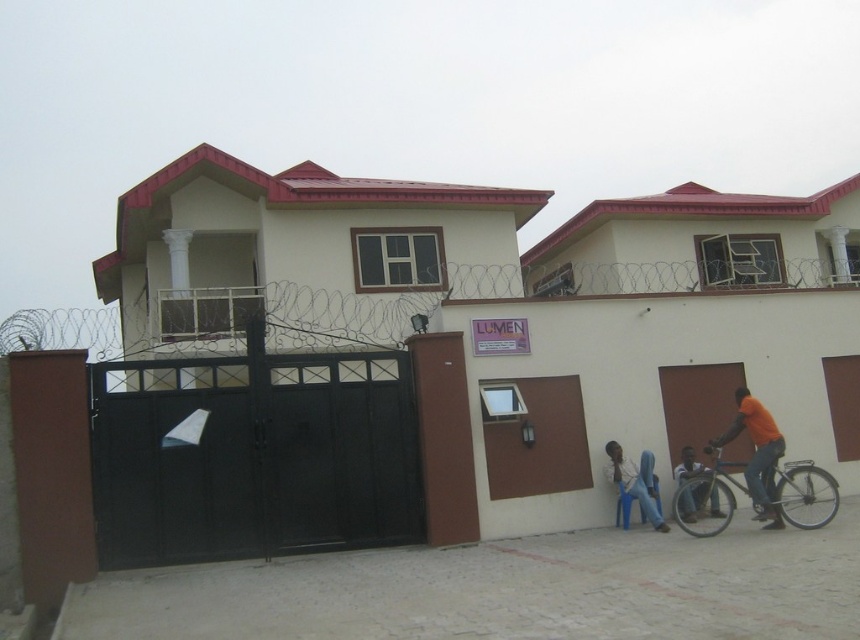
You are a delivery person trying to distinguish between two people wearing orange shirts in the scene. The scene has an orange cotton shirt at right and an orange shirt at lower right. Based on their clothing, which one is narrower?

The orange cotton shirt at right is narrower than the orange shirt at lower right because its width is less than the latter.

You are a delivery person trying to park your blue metallic bicycle at lower right next to the light blue plastic chair at lower right. Since the paved area is narrow, will the bicycle fit next to the chair without overlapping?

The blue metallic bicycle at lower right is wider than the light blue plastic chair at lower right, so there might not be enough space to park them side by side without overlapping. Check the available space carefully.

You are a delivery person standing at the entrance of the residential area. You need to place a package on the light blue plastic chair at lower right and deliver it to the person wearing the orange shirt at lower right. Can you reach the package easily once placed on the chair?

The light blue plastic chair at lower right is much taller than the orange shirt at lower right, so the person wearing the orange shirt at lower right may have difficulty reaching the package placed on the chair without assistance.